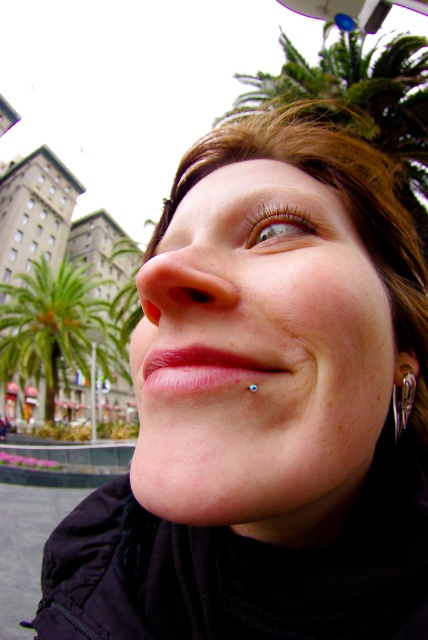
Question: In this image, where is brown matte eye at upper center located relative to silver metallic spike at lower right?

Choices:
 (A) left
 (B) right

Answer: (A)

Question: Does green leafy palm tree at left have a lesser width compared to brown matte eye at upper center?

Choices:
 (A) yes
 (B) no

Answer: (B)

Question: Among these objects, which one is farthest from the camera?

Choices:
 (A) smooth skin face at center
 (B) silver metallic spike at lower right
 (C) brown matte eye at upper center

Answer: (B)

Question: Does smooth skin face at center appear on the left side of silver metallic spike at lower right?

Choices:
 (A) yes
 (B) no

Answer: (A)

Question: Among these points, which one is nearest to the camera?

Choices:
 (A) (315, 291)
 (B) (62, 312)
 (C) (401, 372)
 (D) (297, 225)

Answer: (A)

Question: Which of the following is the closest to the observer?

Choices:
 (A) green leafy palm tree at left
 (B) brown matte eye at upper center
 (C) silver metallic spike at lower right

Answer: (B)